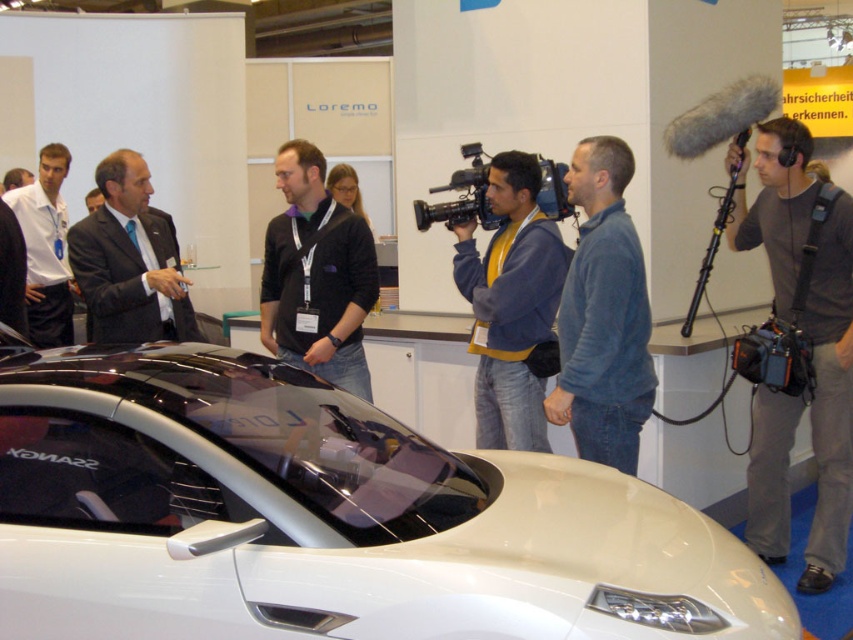
Does blue fleece jacket at center have a greater height compared to black matte video camera at right?

Yes, blue fleece jacket at center is taller than black matte video camera at right.

Is point (566, 412) positioned before point (804, 392)?

Yes, point (566, 412) is closer to viewer.

The width and height of the screenshot is (853, 640). Find the location of `blue fleece jacket at center`. blue fleece jacket at center is located at coordinates (602, 314).

At what (x,y) coordinates should I click in order to perform the action: click on white glossy car at center. Please return your answer as a coordinate pair (x, y). This screenshot has height=640, width=853. Looking at the image, I should click on (325, 518).

Is point (505, 611) positioned in front of point (485, 182)?

Yes, point (505, 611) is in front of point (485, 182).

At what (x,y) coordinates should I click in order to perform the action: click on white glossy car at center. Please return your answer as a coordinate pair (x, y). The height and width of the screenshot is (640, 853). Looking at the image, I should click on (325, 518).

Is white glossy car at center shorter than gray fabric camera at right?

Indeed, white glossy car at center has a lesser height compared to gray fabric camera at right.

From the picture: How far apart are white glossy car at center and gray fabric camera at right?

white glossy car at center is 7.05 feet away from gray fabric camera at right.

Find the location of `white glossy car at center`. white glossy car at center is located at coordinates (325, 518).